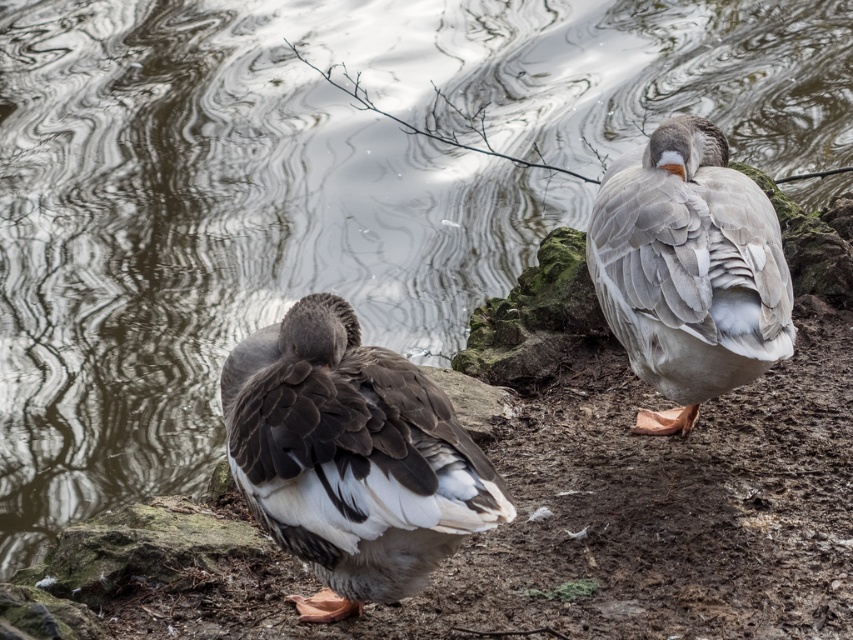
Does brown feathered duck at center have a larger size compared to gray feathered goose at right?

No.

Measure the distance between point (x=329, y=296) and camera.

Point (x=329, y=296) is 12.07 feet away from camera.

Between point (236, 394) and point (697, 308), which one is positioned behind?

The point (697, 308) is more distant.

Where is `brown feathered duck at center`? The height and width of the screenshot is (640, 853). brown feathered duck at center is located at coordinates (351, 458).